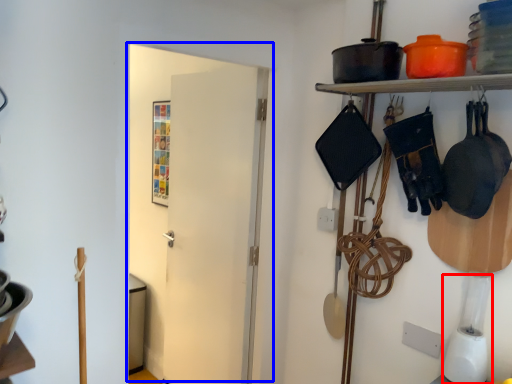
Question: Which object appears closest to the camera in this image, appliance (highlighted by a red box) or door (highlighted by a blue box)?

Choices:
 (A) appliance
 (B) door

Answer: (A)